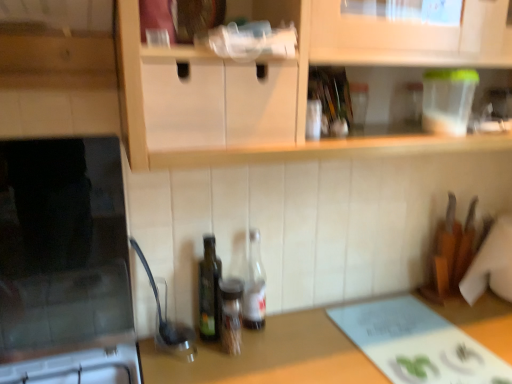
Question: Is green glass bottle at center, which is counted as the first bottle, starting from the left, to the right of translucent glass bottle at center, which appears as the 3th bottle when viewed from the left, from the viewer's perspective?

Choices:
 (A) no
 (B) yes

Answer: (A)

Question: Is green glass bottle at center, arranged as the third bottle when viewed from the right, shorter than translucent glass bottle at center, which appears as the 3th bottle when viewed from the left?

Choices:
 (A) no
 (B) yes

Answer: (A)

Question: From a real-world perspective, is green glass bottle at center, arranged as the third bottle when viewed from the right, located beneath translucent glass bottle at center, which appears as the 3th bottle when viewed from the left?

Choices:
 (A) yes
 (B) no

Answer: (B)

Question: From a real-world perspective, does green glass bottle at center, arranged as the third bottle when viewed from the right, stand above translucent glass bottle at center, the first bottle when ordered from right to left?

Choices:
 (A) yes
 (B) no

Answer: (A)

Question: Is green glass bottle at center, which is counted as the first bottle, starting from the left, bigger than translucent glass bottle at center, the first bottle when ordered from right to left?

Choices:
 (A) yes
 (B) no

Answer: (A)

Question: Is green glass bottle at center, arranged as the third bottle when viewed from the right, behind translucent glass bottle at center, the first bottle when ordered from right to left?

Choices:
 (A) no
 (B) yes

Answer: (A)

Question: Can you confirm if green glass bottle at center, arranged as the third bottle when viewed from the right, is shorter than brown wooden countertop at center?

Choices:
 (A) yes
 (B) no

Answer: (A)

Question: Does green glass bottle at center, arranged as the third bottle when viewed from the right, appear on the left side of brown wooden countertop at center?

Choices:
 (A) no
 (B) yes

Answer: (B)

Question: Does green glass bottle at center, which is counted as the first bottle, starting from the left, have a greater width compared to brown wooden countertop at center?

Choices:
 (A) yes
 (B) no

Answer: (B)

Question: Is green glass bottle at center, which is counted as the first bottle, starting from the left, at the right side of brown wooden countertop at center?

Choices:
 (A) no
 (B) yes

Answer: (A)

Question: Does green glass bottle at center, which is counted as the first bottle, starting from the left, have a smaller size compared to brown wooden countertop at center?

Choices:
 (A) yes
 (B) no

Answer: (A)

Question: Is green glass bottle at center, which is counted as the first bottle, starting from the left, thinner than brown wooden countertop at center?

Choices:
 (A) no
 (B) yes

Answer: (B)

Question: Can you confirm if brown wooden countertop at center is positioned to the left of translucent glass bottle at center, the first bottle when ordered from right to left?

Choices:
 (A) yes
 (B) no

Answer: (B)